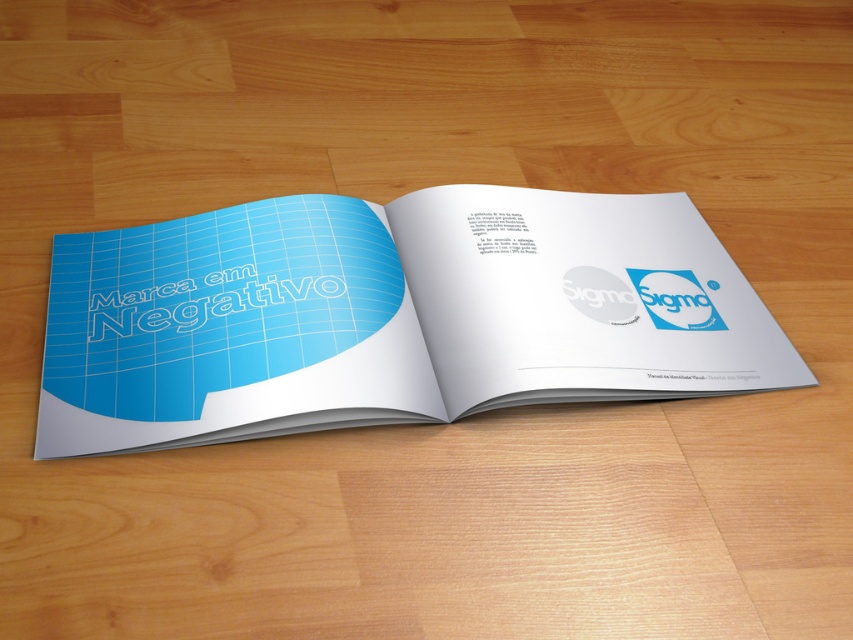
Question: Which object is closer to the camera taking this photo?

Choices:
 (A) blue glossy logo at center
 (B) blue paper book at center

Answer: (B)

Question: Which point is closer to the camera taking this photo?

Choices:
 (A) (322, 323)
 (B) (682, 314)

Answer: (A)

Question: Is blue paper book at center above blue glossy logo at center?

Choices:
 (A) yes
 (B) no

Answer: (A)

Question: Is blue paper book at center to the right of blue glossy logo at center from the viewer's perspective?

Choices:
 (A) no
 (B) yes

Answer: (A)

Question: Does blue paper book at center come behind blue glossy logo at center?

Choices:
 (A) no
 (B) yes

Answer: (A)